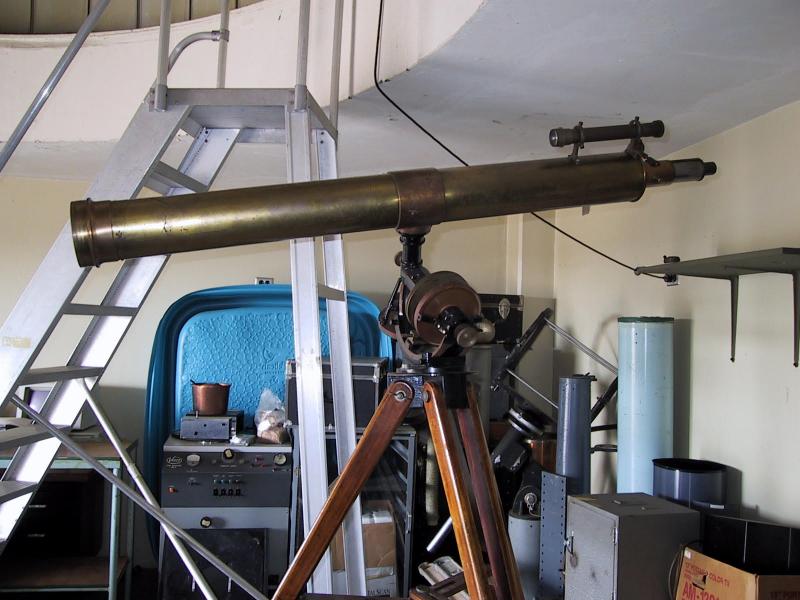
Identify the location of locker. (589, 551).